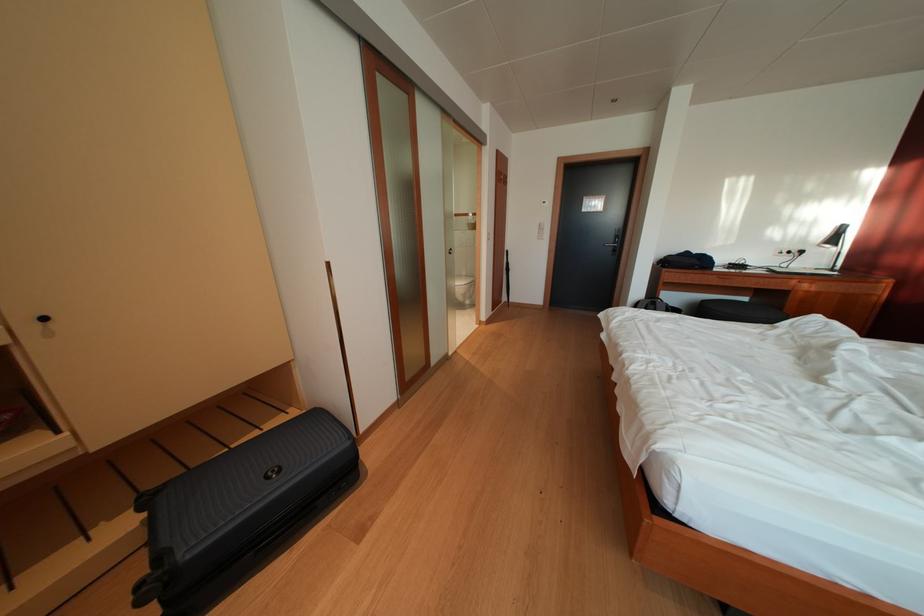
What do you see at coordinates (43, 318) in the screenshot? This screenshot has height=616, width=924. I see `the recessed door pull` at bounding box center [43, 318].